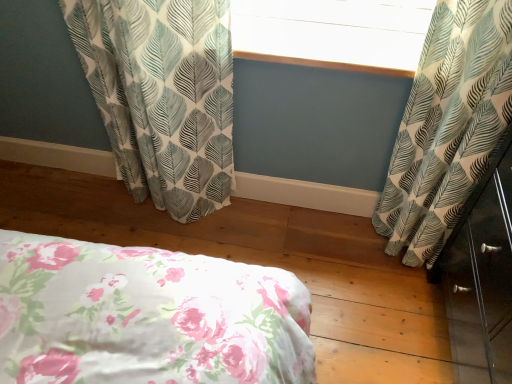
Find the location of a particular element. Image resolution: width=512 pixels, height=384 pixels. free point in front of white leaf-patterned curtain at right, the 2th curtain from the left is located at coordinates (382, 279).